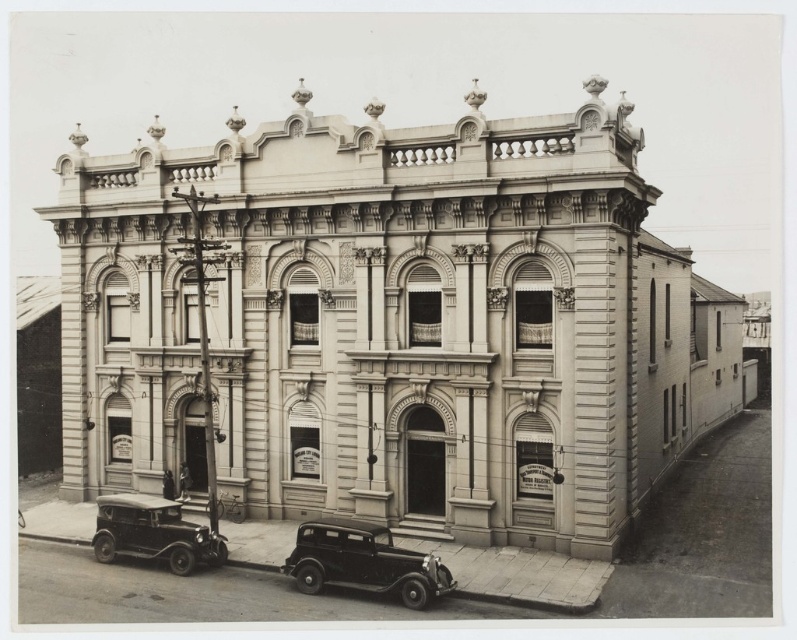
Question: Does shiny black car at lower center come in front of shiny black car at lower left?

Choices:
 (A) no
 (B) yes

Answer: (B)

Question: Which of the following is the closest to the observer?

Choices:
 (A) shiny black car at lower center
 (B) shiny black car at lower left

Answer: (A)

Question: Which object is farther from the camera taking this photo?

Choices:
 (A) shiny black car at lower center
 (B) shiny black car at lower left

Answer: (B)

Question: Does shiny black car at lower center appear under shiny black car at lower left?

Choices:
 (A) yes
 (B) no

Answer: (B)

Question: Does shiny black car at lower center appear on the right side of shiny black car at lower left?

Choices:
 (A) no
 (B) yes

Answer: (B)